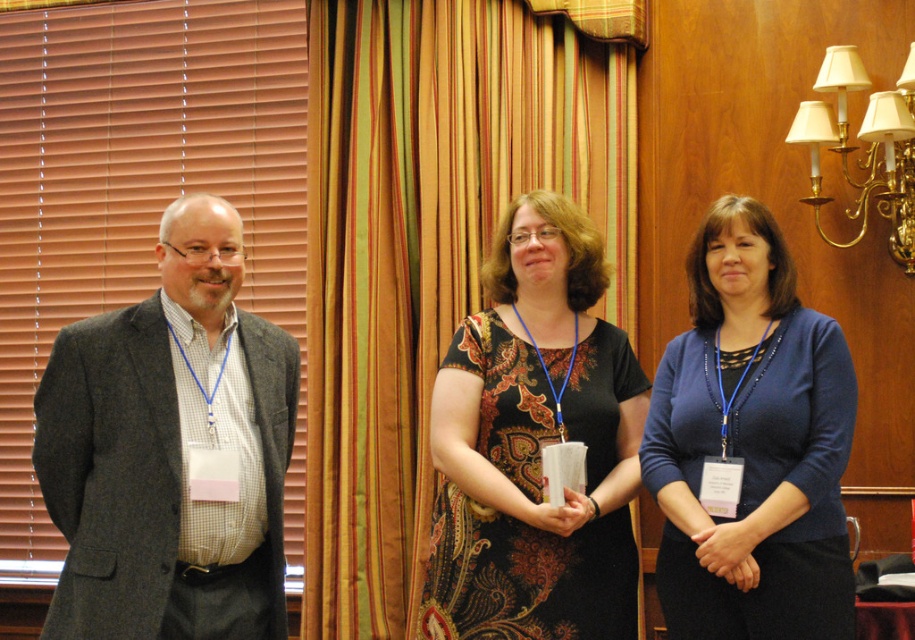
Question: Can you confirm if striped fabric curtain at center is positioned to the right of paisley-patterned dress at center?

Choices:
 (A) yes
 (B) no

Answer: (B)

Question: Can you confirm if gray wool suit at left is smaller than blue fabric sweater at center?

Choices:
 (A) yes
 (B) no

Answer: (B)

Question: Which is farther from the gray wool suit at left?

Choices:
 (A) blue fabric sweater at center
 (B) paisley-patterned dress at center

Answer: (A)

Question: Is paisley-patterned dress at center positioned before blue fabric sweater at center?

Choices:
 (A) no
 (B) yes

Answer: (A)

Question: Which point is farther from the camera taking this photo?

Choices:
 (A) (358, 56)
 (B) (808, 497)
 (C) (603, 346)

Answer: (A)

Question: Which point is closer to the camera?

Choices:
 (A) blue fabric sweater at center
 (B) paisley-patterned dress at center
 (C) striped fabric curtain at center
 (D) gray wool suit at left

Answer: (D)